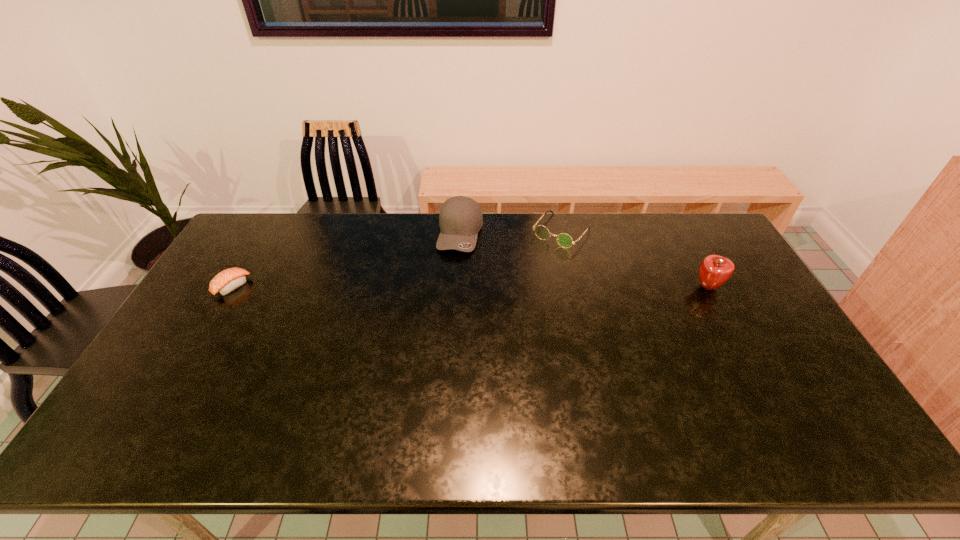
This screenshot has width=960, height=540. Identify the location of vacant space located on the front brim of the baseball cap. (449, 308).

Identify the location of free space located 0.100m on the lenses of the second object from right to left. This screenshot has height=540, width=960. (536, 264).

This screenshot has height=540, width=960. In order to click on vacant space located on the lenses of the second object from right to left in this screenshot , I will do `click(536, 264)`.

At what (x,y) coordinates should I click in order to perform the action: click on free space located 0.210m on the lenses of the second object from right to left. Please return your answer as a coordinate pair (x, y). This screenshot has height=540, width=960. Looking at the image, I should click on (520, 283).

What are the coordinates of `baseball cap that is at the far edge` in the screenshot? It's located at (460, 219).

Image resolution: width=960 pixels, height=540 pixels. Identify the location of spectacles that is at the far edge. tap(564, 240).

At what (x,y) coordinates should I click in order to perform the action: click on object positioned at the left edge. Please return your answer as a coordinate pair (x, y). Image resolution: width=960 pixels, height=540 pixels. Looking at the image, I should click on (230, 279).

I want to click on object present at the right edge, so click(x=715, y=270).

Where is `vacant space at the far edge of the desktop`? This screenshot has width=960, height=540. vacant space at the far edge of the desktop is located at coordinates (678, 252).

The height and width of the screenshot is (540, 960). In order to click on free region at the near edge in this screenshot , I will do `click(651, 408)`.